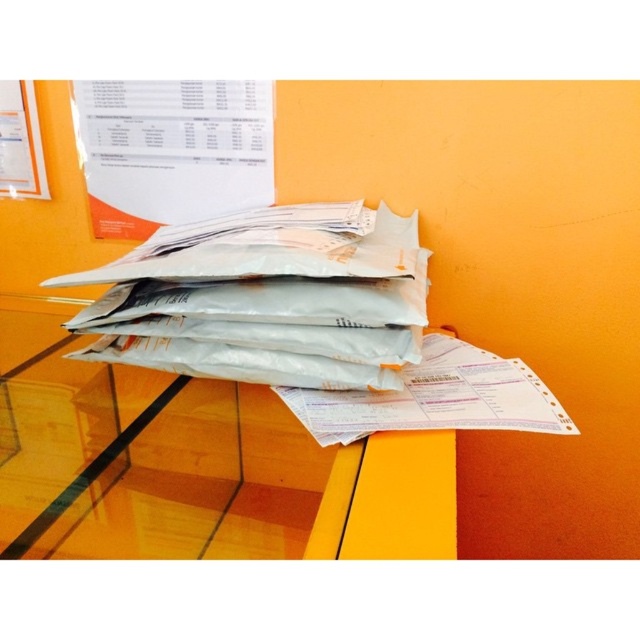
You are organizing documents on a glass table and need to place a white paper at center. Where should you place it relative to the transparent glass table at center?

The white paper at center should be placed on the right side of the transparent glass table at center since the table is on its left side according to the description.

You are organizing a shipment and need to place a shipping label on the transparent glass table at center. However, there are white matte envelopes at center in the way. Based on their positions, can you move the envelopes to the right to make space for the label?

The transparent glass table at center is positioned on the left side of white matte envelopes at center, so moving the white matte envelopes at center to the right would free up space on the left side of the table for placing the shipping label.